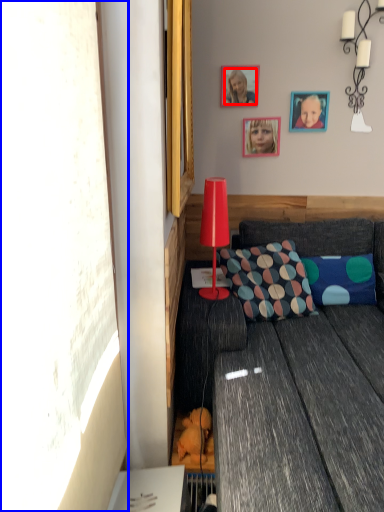
Question: Which point is closer to the camera, person (highlighted by a red box) or window screen (highlighted by a blue box)?

Choices:
 (A) person
 (B) window screen

Answer: (B)